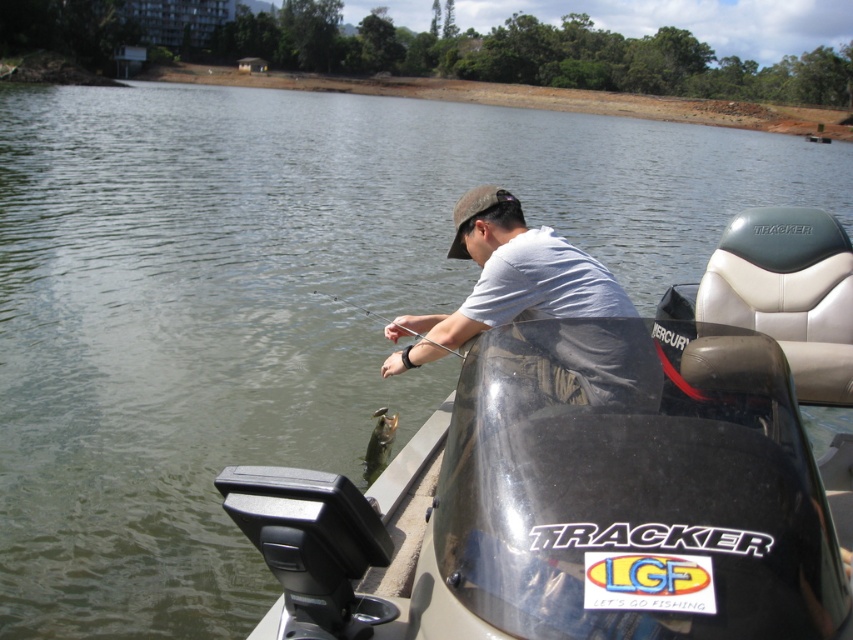
Question: Does white matte shirt at center appear on the left side of shiny silver fish at lower center?

Choices:
 (A) yes
 (B) no

Answer: (B)

Question: Can you confirm if white matte shirt at center is positioned to the right of shiny silver fish at lower center?

Choices:
 (A) no
 (B) yes

Answer: (B)

Question: Can you confirm if white matte shirt at center is positioned above shiny silver fish at lower center?

Choices:
 (A) yes
 (B) no

Answer: (A)

Question: Among these points, which one is farthest from the camera?

Choices:
 (A) (376, 467)
 (B) (585, 314)

Answer: (A)

Question: Which object is closer to the camera taking this photo?

Choices:
 (A) shiny silver fish at lower center
 (B) white matte shirt at center

Answer: (B)

Question: Among these objects, which one is nearest to the camera?

Choices:
 (A) shiny silver fish at lower center
 (B) white matte shirt at center

Answer: (B)